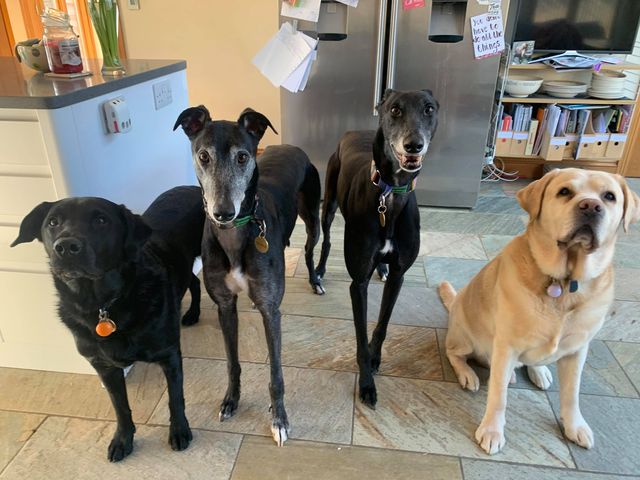
You are a GUI agent. You are given a task and a screenshot of the screen. Output one action in this format:
    pyautogui.click(x=<x>, y=<y>)
    Task: Click on the tv
    The width and height of the screenshot is (640, 480).
    Given the screenshot: What is the action you would take?
    pyautogui.click(x=582, y=35)